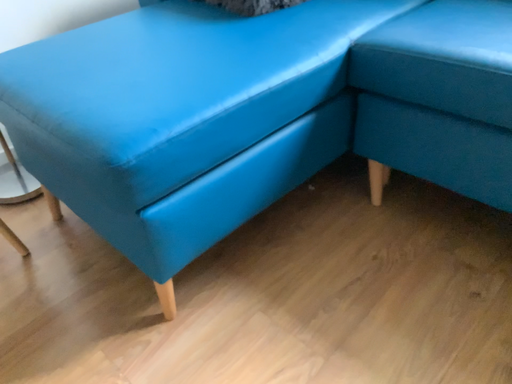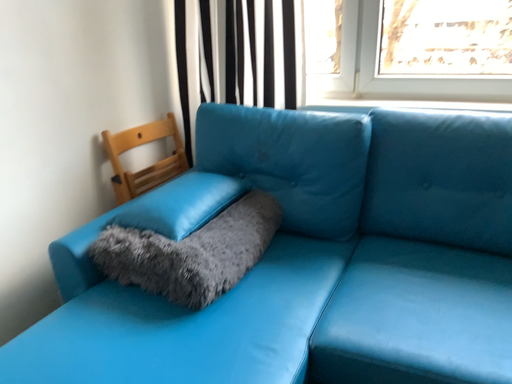
Question: Which way did the camera rotate in the video?

Choices:
 (A) rotated left
 (B) rotated right

Answer: (B)